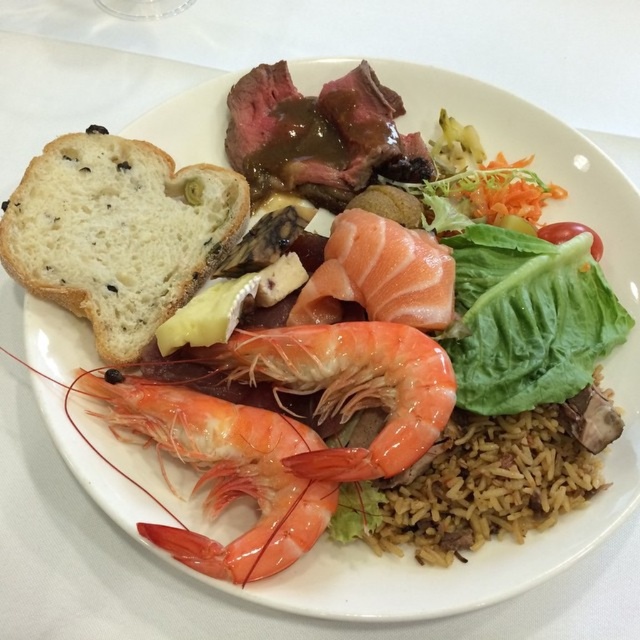
Question: Is white soft bread at left wider than green leafy lettuce at center?

Choices:
 (A) no
 (B) yes

Answer: (B)

Question: Which of the following is the closest to the observer?

Choices:
 (A) green leafy lettuce at center
 (B) brown rice at center
 (C) pink smooth salmon at center

Answer: (B)

Question: Which object is closer to the camera taking this photo?

Choices:
 (A) shiny orange shrimp at center
 (B) pink smooth salmon at center
 (C) white soft bread at left
 (D) brown rice at center

Answer: (A)

Question: Can you confirm if white soft bread at left is wider than brown rice at center?

Choices:
 (A) no
 (B) yes

Answer: (A)

Question: Which point is farther from the camera taking this photo?

Choices:
 (A) (388, 497)
 (B) (532, 355)

Answer: (B)

Question: Is white soft bread at left behind brown rice at center?

Choices:
 (A) yes
 (B) no

Answer: (A)